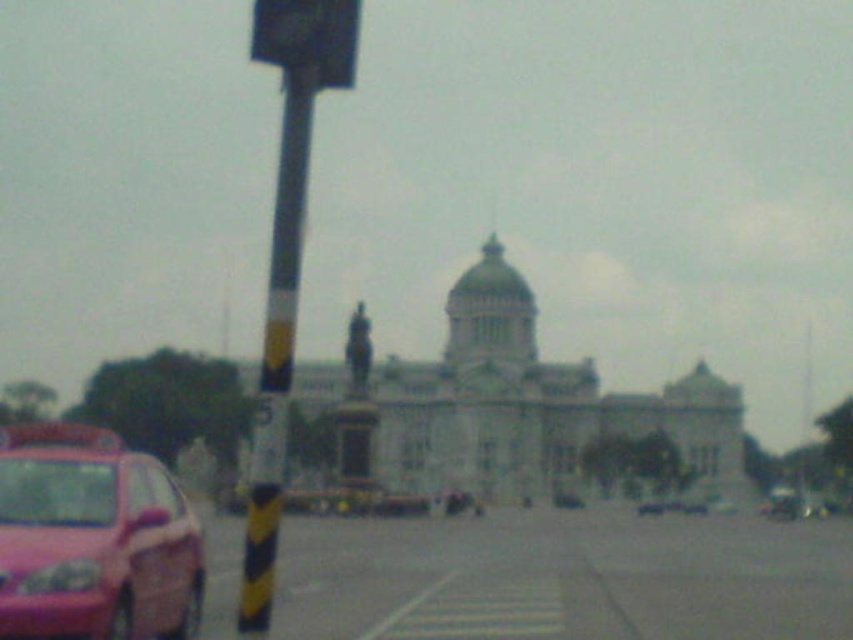
Is pink glossy car at lower left to the right of yellow and black striped pole at left from the viewer's perspective?

No, pink glossy car at lower left is not to the right of yellow and black striped pole at left.

Who is positioned more to the right, pink glossy car at lower left or yellow and black striped pole at left?

yellow and black striped pole at left is more to the right.

Who is more forward, (16, 621) or (285, 170)?

Point (285, 170) is more forward.

The image size is (853, 640). I want to click on pink glossy car at lower left, so click(x=91, y=540).

Can you confirm if dark gray plastic traffic light at upper center is positioned to the left of pink matte car at lower left?

Correct, you'll find dark gray plastic traffic light at upper center to the left of pink matte car at lower left.

Who is more forward, (259, 36) or (637, 504)?

Point (259, 36) is more forward.

Image resolution: width=853 pixels, height=640 pixels. In order to click on dark gray plastic traffic light at upper center in this screenshot , I will do `click(308, 36)`.

Can you confirm if yellow and black striped pole at left is positioned to the left of dark gray plastic traffic light at upper center?

Yes, yellow and black striped pole at left is to the left of dark gray plastic traffic light at upper center.

Can you confirm if yellow and black striped pole at left is positioned below dark gray plastic traffic light at upper center?

Yes.

Who is more forward, (x=294, y=198) or (x=325, y=33)?

Point (x=325, y=33)

Find the location of a particular element. This screenshot has width=853, height=640. yellow and black striped pole at left is located at coordinates (276, 358).